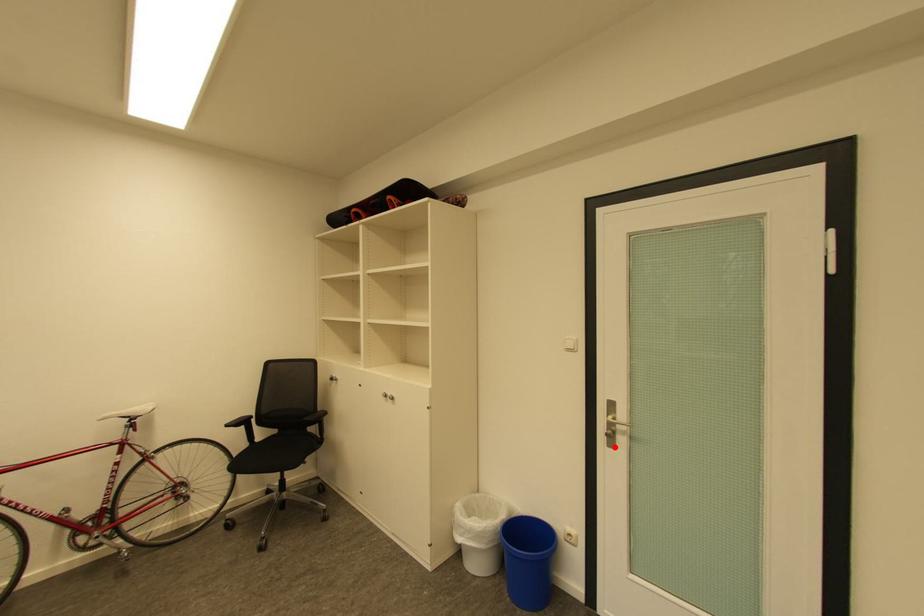
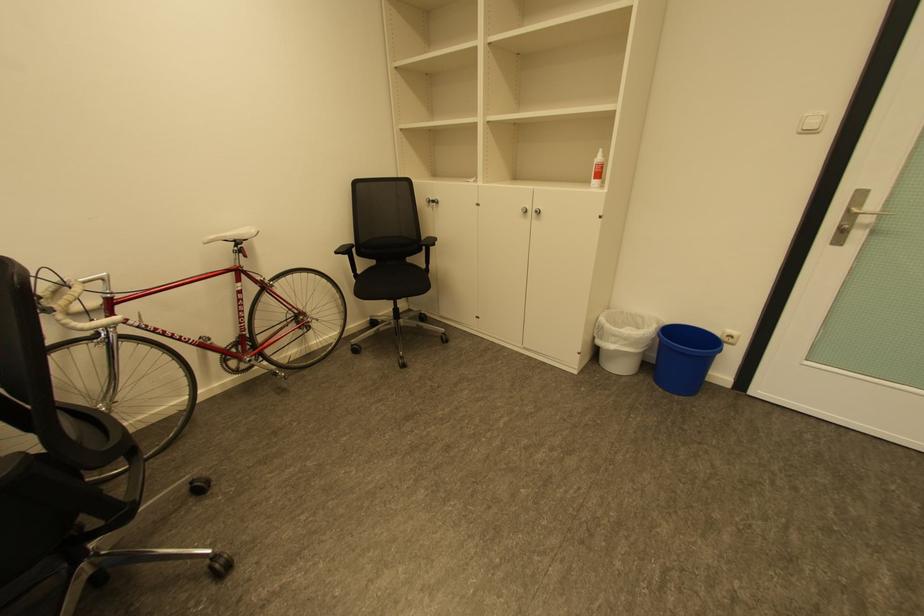
Where in the second image is the point corresponding to the highlighted location from the first image?

(837, 245)